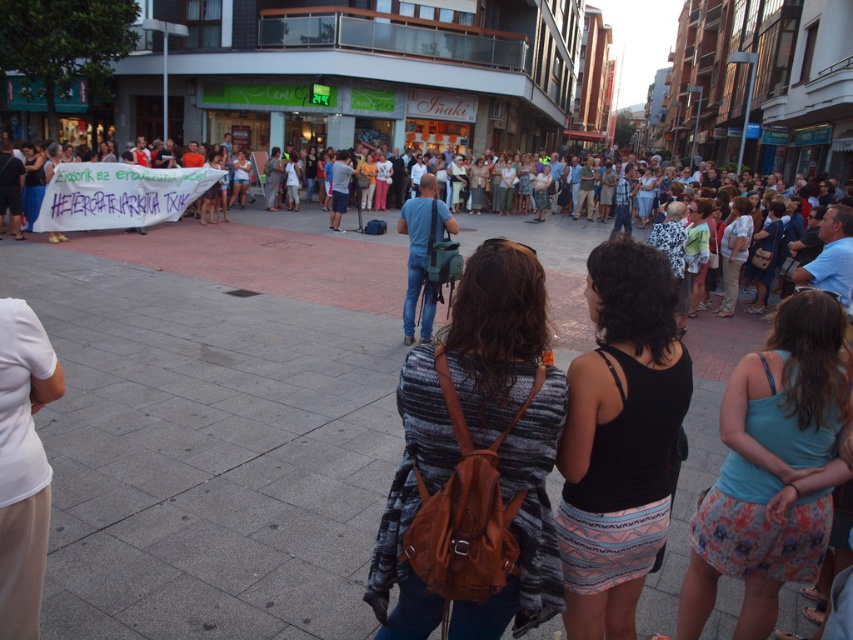
You are a photographer aiming to capture the crowd in the urban street scene. You notice a person wearing a blue cotton tank top at center and another wearing denim jeans at center. From your vantage point, which clothing item is positioned to the right?

The blue cotton tank top at center is to the right of the denim jeans at center, so the blue cotton tank top at center is positioned to the right.